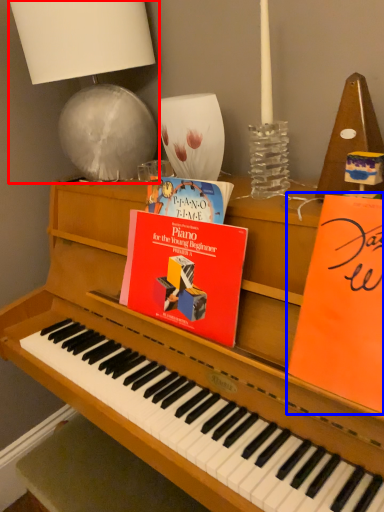
Question: Which object appears farthest to the camera in this image, table lamp (highlighted by a red box) or paperback book (highlighted by a blue box)?

Choices:
 (A) table lamp
 (B) paperback book

Answer: (A)